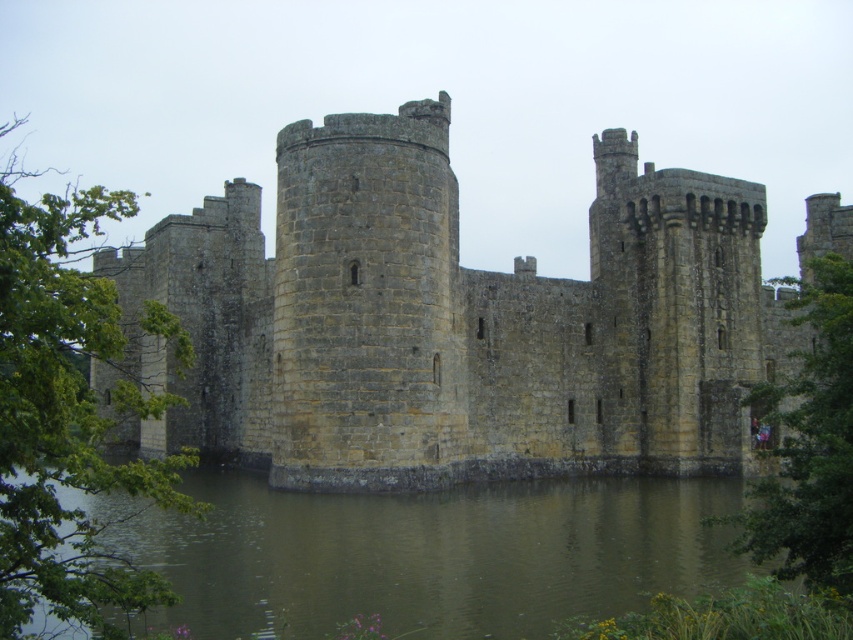
Between point (622, 161) and point (259, 509), which one is positioned behind?

Positioned behind is point (622, 161).

Can you confirm if stone castle at center is shorter than brown stone water at lower center?

No, stone castle at center is not shorter than brown stone water at lower center.

What do you see at coordinates (451, 321) in the screenshot? I see `stone castle at center` at bounding box center [451, 321].

Identify the location of stone castle at center. coord(451,321).